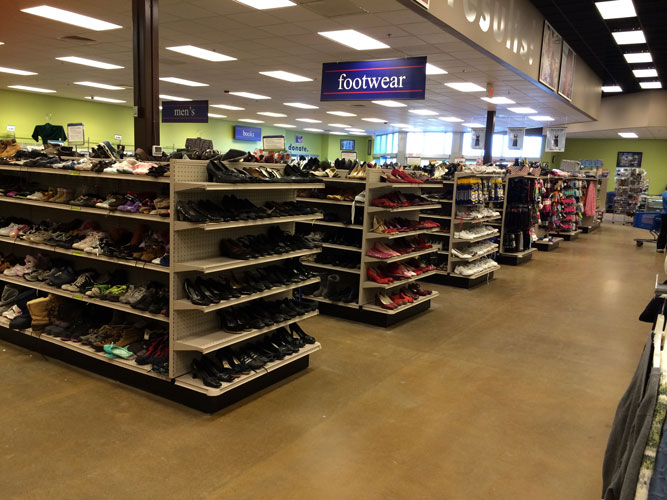
This screenshot has height=500, width=667. In order to click on floor in this screenshot , I will do `click(460, 425)`.